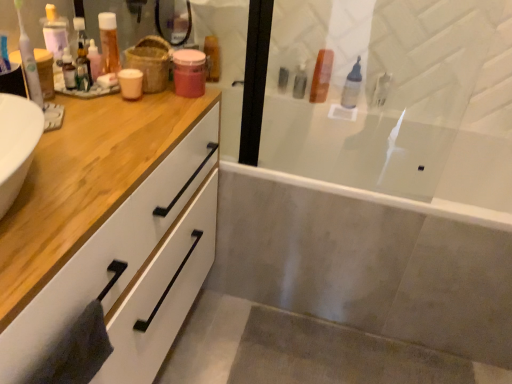
Question: Is white plastic toothbrush at left outside of translucent plastic bottle at upper left, which is counted as the 4th toiletry, starting from the right?

Choices:
 (A) no
 (B) yes

Answer: (B)

Question: Does white plastic toothbrush at left have a greater width compared to translucent plastic bottle at upper left, acting as the 2th toiletry starting from the left?

Choices:
 (A) yes
 (B) no

Answer: (B)

Question: Can you confirm if white plastic toothbrush at left is thinner than translucent plastic bottle at upper left, acting as the 2th toiletry starting from the left?

Choices:
 (A) yes
 (B) no

Answer: (A)

Question: Can you confirm if white plastic toothbrush at left is smaller than translucent plastic bottle at upper left, which is the second toiletry from front to back?

Choices:
 (A) yes
 (B) no

Answer: (A)

Question: Can translucent plastic bottle at upper left, the fourth toiletry when ordered from back to front, be found inside white plastic toothbrush at left?

Choices:
 (A) yes
 (B) no

Answer: (B)

Question: Is white glossy bathtub at center bigger or smaller than white plastic toothbrush at left?

Choices:
 (A) small
 (B) big

Answer: (B)

Question: Which is correct: white glossy bathtub at center is inside white plastic toothbrush at left, or outside of it?

Choices:
 (A) inside
 (B) outside

Answer: (B)

Question: Is white glossy bathtub at center taller or shorter than white plastic toothbrush at left?

Choices:
 (A) short
 (B) tall

Answer: (B)

Question: From a real-world perspective, relative to white plastic toothbrush at left, is white glossy bathtub at center vertically above or below?

Choices:
 (A) below
 (B) above

Answer: (A)

Question: Is translucent plastic bottle at upper left, which is counted as the 4th toiletry, starting from the right, in front of or behind white plastic toothbrush at left in the image?

Choices:
 (A) front
 (B) behind

Answer: (B)

Question: Considering the positions of translucent plastic bottle at upper left, which is counted as the 4th toiletry, starting from the right, and white plastic toothbrush at left in the image, is translucent plastic bottle at upper left, which is counted as the 4th toiletry, starting from the right, taller or shorter than white plastic toothbrush at left?

Choices:
 (A) tall
 (B) short

Answer: (B)

Question: Is translucent plastic bottle at upper left, acting as the 2th toiletry starting from the left, bigger or smaller than white plastic toothbrush at left?

Choices:
 (A) small
 (B) big

Answer: (B)

Question: Is translucent plastic bottle at upper left, which is the second toiletry from front to back, wider or thinner than white plastic toothbrush at left?

Choices:
 (A) thin
 (B) wide

Answer: (B)

Question: Relative to clear plastic bottle at upper right, the third toiletry positioned from the front, is transparent glass screen door at upper center in front or behind?

Choices:
 (A) behind
 (B) front

Answer: (B)

Question: Does point (279, 162) appear closer or farther from the camera than point (347, 76)?

Choices:
 (A) closer
 (B) farther

Answer: (A)